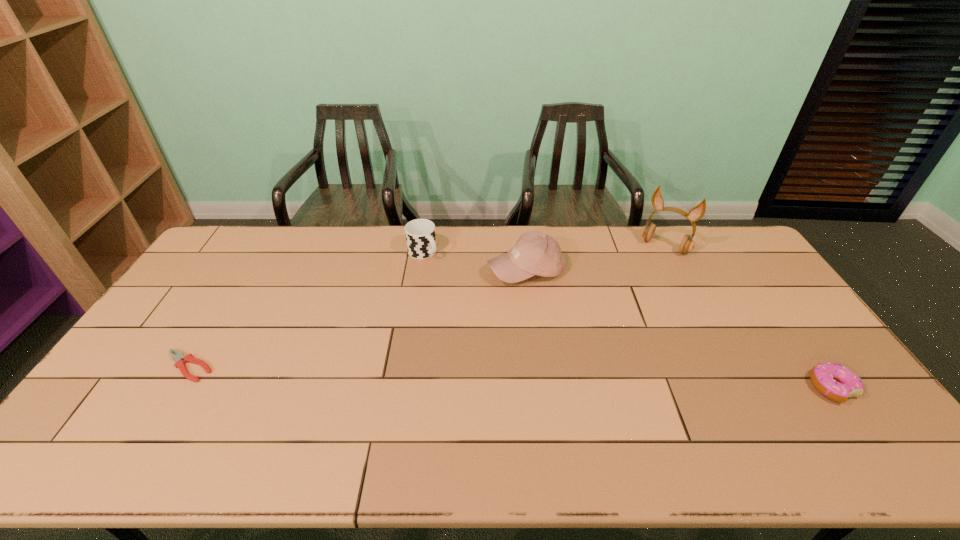
In order to click on vacant space situated 0.400m on the front-facing side of the second object from right to left in this screenshot , I will do `click(613, 323)`.

Locate an element on the screen. cup that is at the far edge is located at coordinates (420, 234).

The width and height of the screenshot is (960, 540). Find the location of `baseball cap at the far edge`. baseball cap at the far edge is located at coordinates (535, 253).

Locate an element on the screen. earphone present at the far edge is located at coordinates (696, 213).

I want to click on object at the near edge, so click(834, 381).

At what (x,y) coordinates should I click in order to perform the action: click on object at the left edge. Please return your answer as a coordinate pair (x, y). Looking at the image, I should click on (179, 358).

Identify the location of object that is at the right edge. The height and width of the screenshot is (540, 960). pos(834,381).

Where is `object at the near right corner`? The height and width of the screenshot is (540, 960). object at the near right corner is located at coordinates (834, 381).

In the image, there is a desktop. In order to click on vacant space at the far edge in this screenshot , I will do `click(310, 265)`.

Locate an element on the screen. The height and width of the screenshot is (540, 960). free space at the near edge is located at coordinates (393, 415).